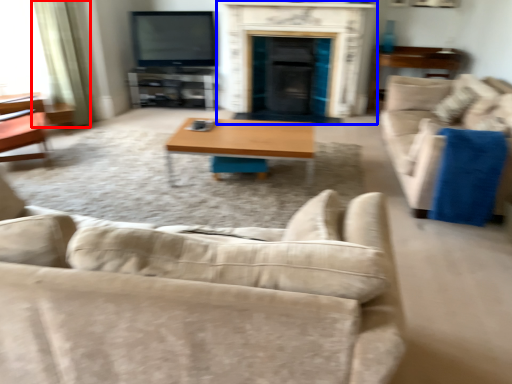
Question: Among these objects, which one is nearest to the camera, curtain (highlighted by a red box) or fireplace (highlighted by a blue box)?

Choices:
 (A) curtain
 (B) fireplace

Answer: (A)